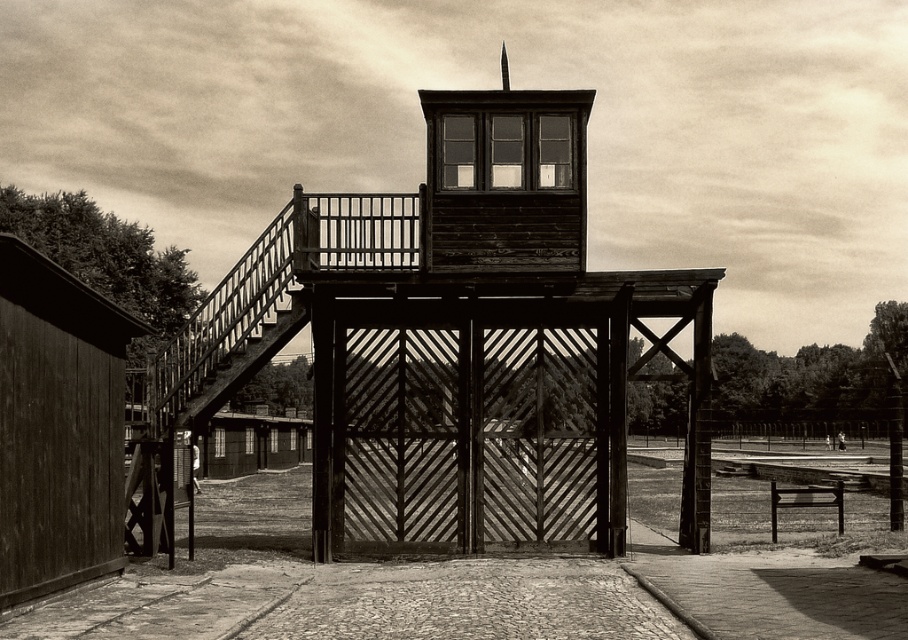
You are a visitor at this historical site and want to take a photo of both the wooden gate at center and the wooden bell tower at center. Can you stand at a distance where both objects are fully visible in your camera frame? Explain your reasoning based on their spatial relationship.

The wooden gate at center and wooden bell tower at center are 6.34 feet apart. Since they are positioned close to each other at the center, you can likely stand at a reasonable distance to capture both in your camera frame without needing to zoom excessively.